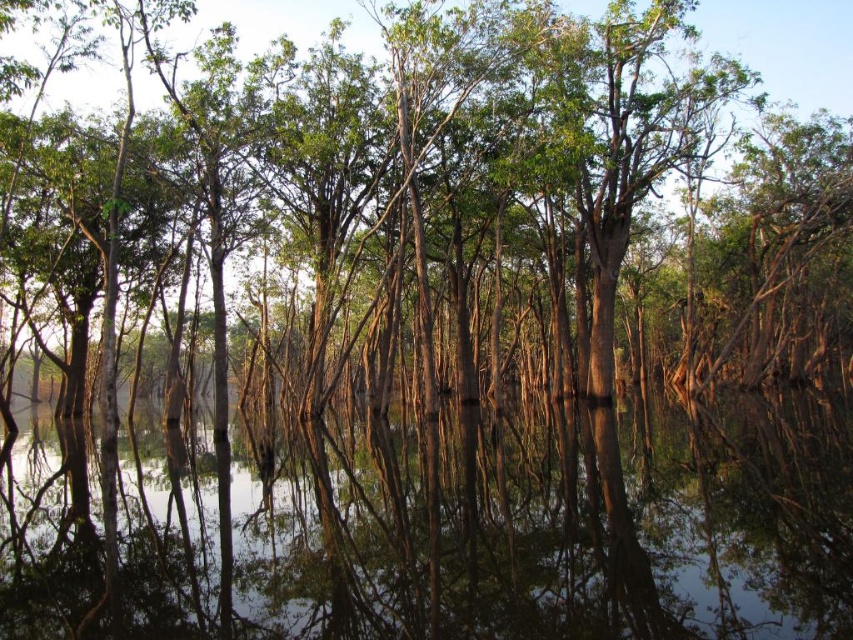
Who is positioned more to the right, clear water at center or green matte tree at center?

Positioned to the right is green matte tree at center.

Between clear water at center and green matte tree at center, which one has more height?

green matte tree at center

You are a GUI agent. You are given a task and a screenshot of the screen. Output one action in this format:
    pyautogui.click(x=<x>, y=<y>)
    Task: Click on the clear water at center
    This screenshot has height=640, width=853.
    Given the screenshot: What is the action you would take?
    pyautogui.click(x=438, y=524)